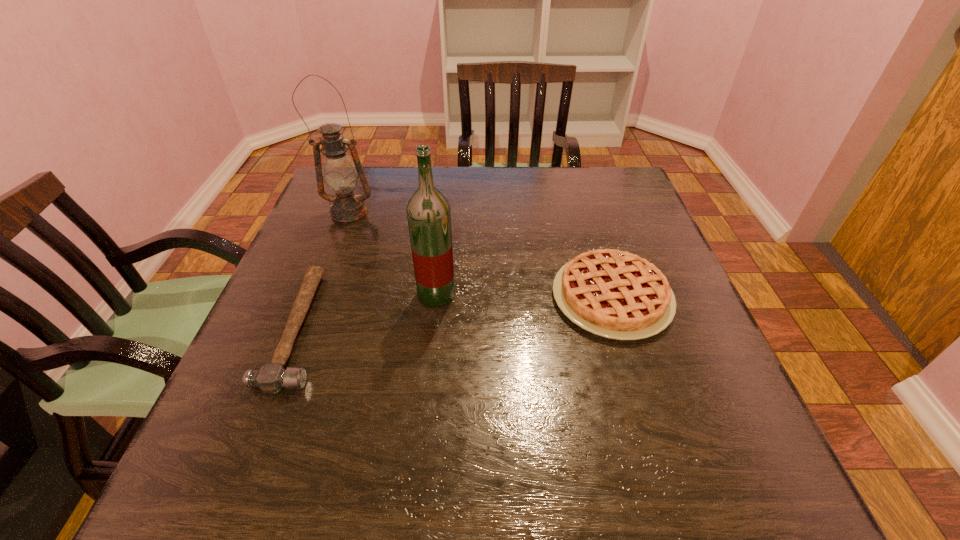
The width and height of the screenshot is (960, 540). What are the coordinates of `vacant space that satisfies the following two spatial constraints: 1. on the front side of the third tallest object; 2. on the striking face of the shortest object` in the screenshot? It's located at (621, 328).

The height and width of the screenshot is (540, 960). What are the coordinates of `vacant area in the image that satisfies the following two spatial constraints: 1. on the front side of the farthest object; 2. on the left side of the rightmost object` in the screenshot? It's located at (317, 297).